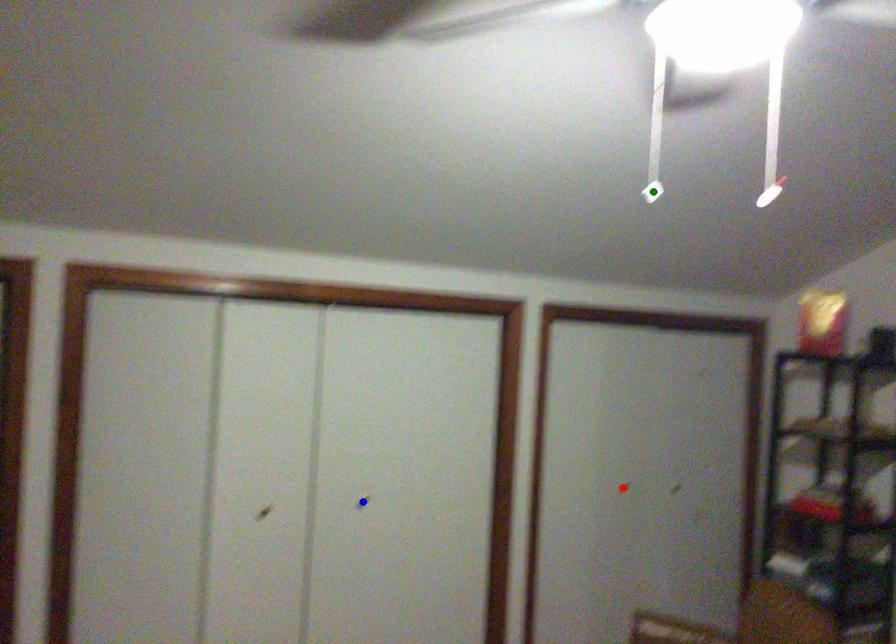
Order these from farthest to nearest:
green point, blue point, red point

red point < blue point < green point